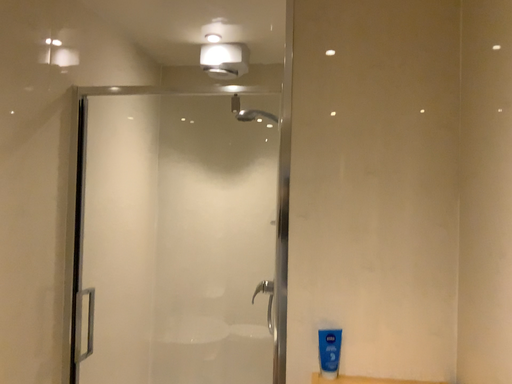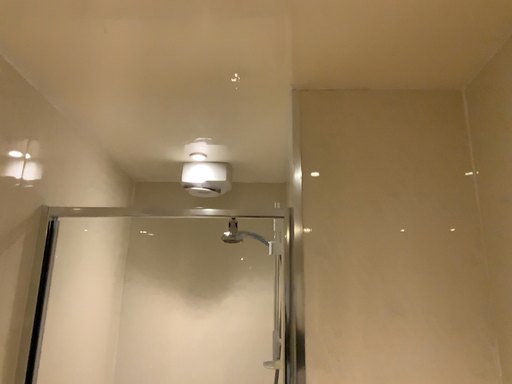
Question: Which way did the camera rotate in the video?

Choices:
 (A) rotated downward
 (B) rotated upward

Answer: (B)